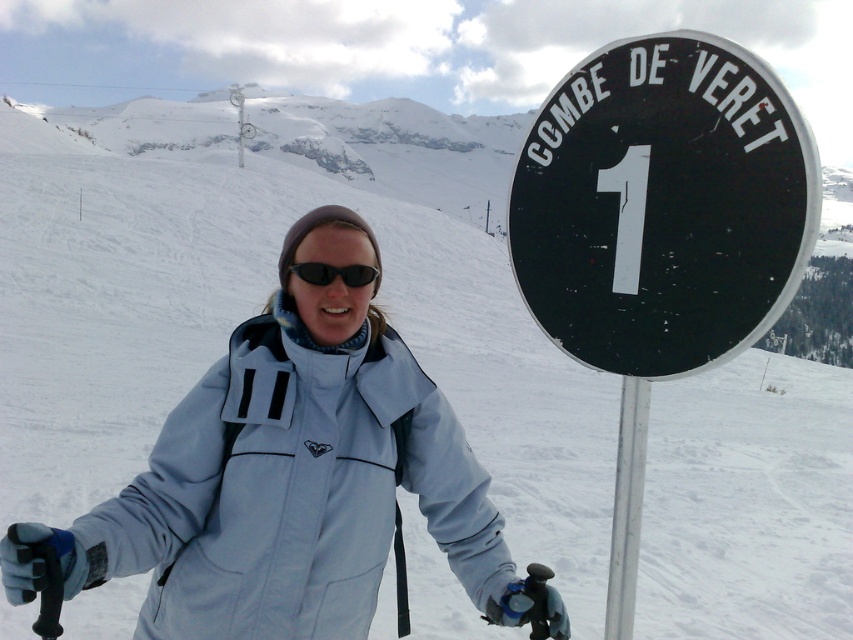
Does black plastic sign at upper right lie behind black matte sunglasses at center?

That is False.

Find the location of a particular element. black plastic sign at upper right is located at coordinates (663, 204).

This screenshot has width=853, height=640. I want to click on black plastic sign at upper right, so click(x=663, y=204).